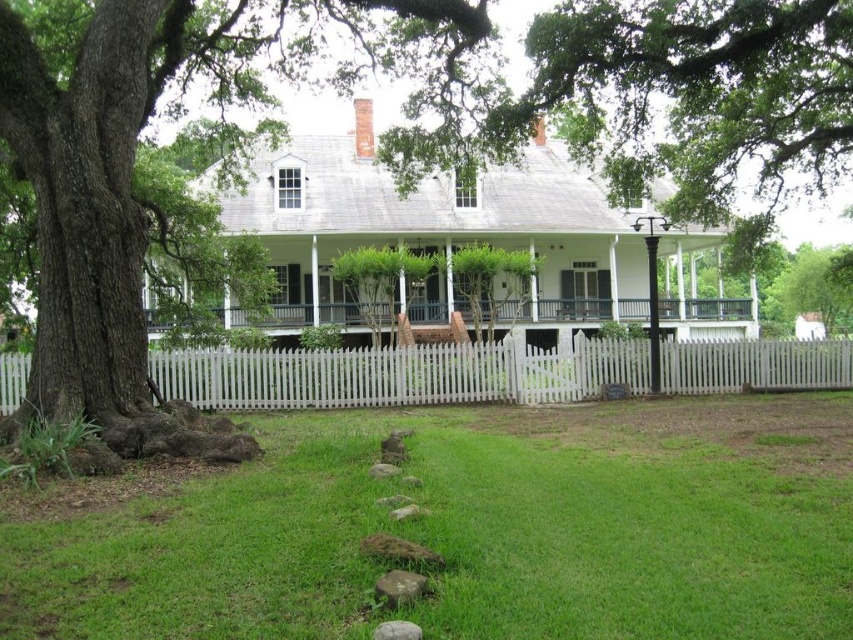
You are a gardener who wants to mow the green grass at lower center. Can you safely drive your lawn mower over the white wooden porch at center without damaging it?

The green grass at lower center has a lesser height compared to the white wooden porch at center, so the lawn mower can safely drive over the white wooden porch at center without damaging it since the porch is higher and the grass is shorter.

You are standing in front of the plantation house and want to walk from the white picket fence at center to the white wooden porch at center. Which direction should you move to get closer to the porch?

You should move forward towards the white wooden porch at center because the white picket fence at center is closer to you than the porch, meaning the porch is behind the fence.